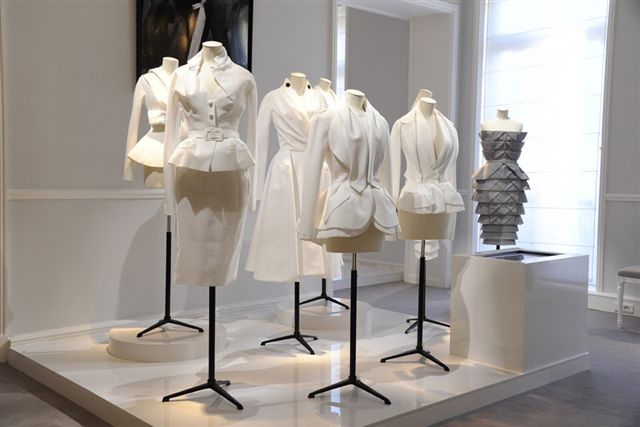
Locate an element on the screen. This screenshot has height=427, width=640. picture is located at coordinates (162, 33).